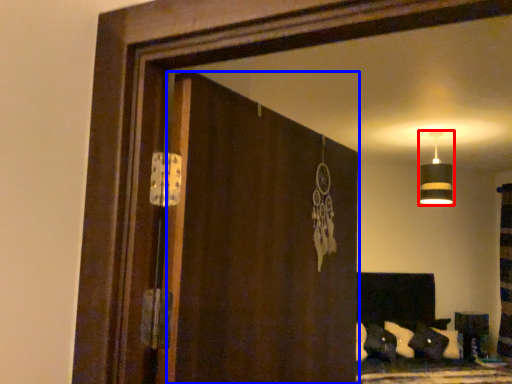
Question: Which point is further to the camera, lamp (highlighted by a red box) or screen door (highlighted by a blue box)?

Choices:
 (A) lamp
 (B) screen door

Answer: (A)